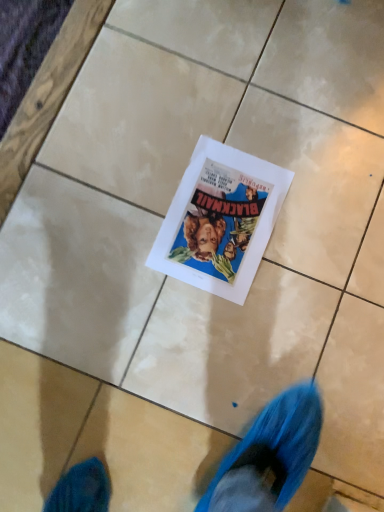
Locate an element on the screen. vacant space underneath matte paper poster at center (from a real-world perspective) is located at coordinates (222, 219).